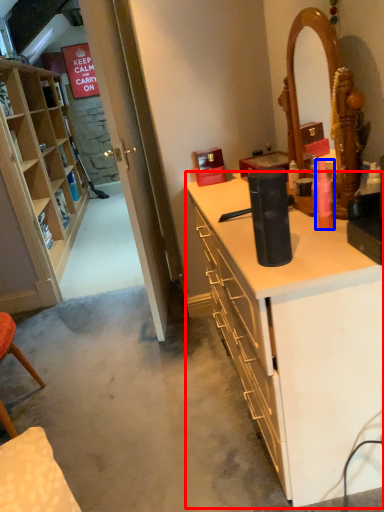
Question: Which of the following is the closest to the observer, desk (highlighted by a red box) or toiletry (highlighted by a blue box)?

Choices:
 (A) desk
 (B) toiletry

Answer: (A)